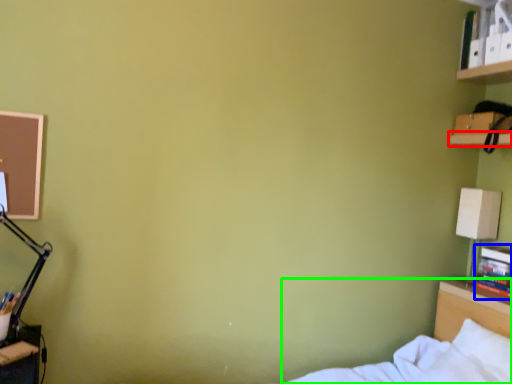
Question: Estimate the real-world distances between objects in this image. Which object is farther from shelf (highlighted by a red box), book (highlighted by a blue box) or bed (highlighted by a green box)?

Choices:
 (A) book
 (B) bed

Answer: (B)